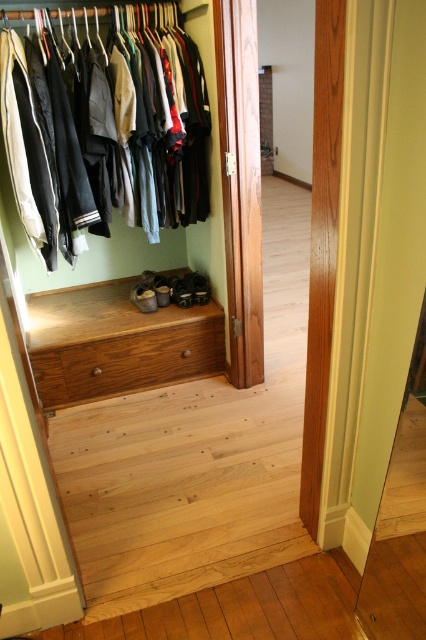
You are standing in front of the closet and want to place a pair of shoes on the wooden drawer at center. Where exactly should you place them?

You should place the shoes at point (117, 342) on the wooden drawer at center.

You are trying to place a new pair of matte black shoes at center into the closet. The existing space where you want to put them is currently occupied by a matte black shoe at center. Can the new pair fit in the same space without overlapping?

The existing matte black shoe at center is narrower than the new matte black shoes at center, so the new pair might not fit in the same space without overlapping because they are wider.

You are trying to reach the matte brown shoe at center in the closet. However, the matte black clothes at upper left are blocking your access. Can you move the clothes to get to the shoe?

The matte black clothes at upper left are closer to the viewer than the matte brown shoe at center, so you can move the matte black clothes at upper left to access the matte brown shoe at center.